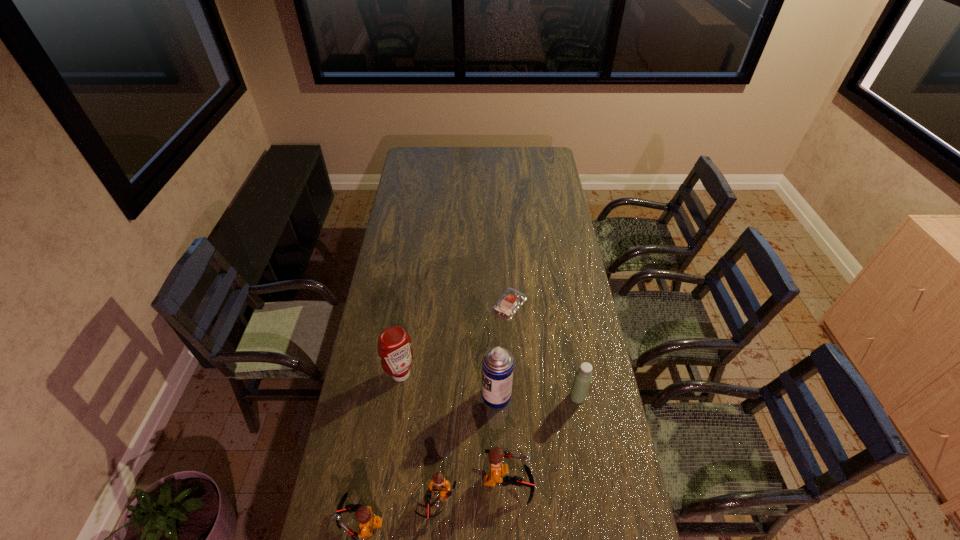
You are a GUI agent. You are given a task and a screenshot of the screen. Output one action in this format:
    pyautogui.click(x=<x>, y=<y>)
    Task: Click on the vacant space located on the front of the second tallest object
    This screenshot has height=540, width=960.
    Given the screenshot: What is the action you would take?
    pyautogui.click(x=388, y=464)

I want to click on vacant area situated on the label side of the tallest object, so click(x=444, y=396).

What are the coordinates of `free space located 0.220m on the label side of the tallest object` in the screenshot? It's located at (420, 396).

Identify the location of vacant space located 0.280m on the label side of the tallest object. Image resolution: width=960 pixels, height=540 pixels. tap(402, 396).

Where is `free space located on the front of the rightmost object`? This screenshot has width=960, height=540. free space located on the front of the rightmost object is located at coordinates (594, 495).

I want to click on object present at the left edge, so click(x=394, y=343).

The width and height of the screenshot is (960, 540). In order to click on object that is positioned at the right edge in this screenshot , I will do `click(583, 377)`.

This screenshot has height=540, width=960. Find the location of `vacant space at the far edge of the desktop`. vacant space at the far edge of the desktop is located at coordinates (489, 163).

I want to click on vacant area at the near edge, so click(x=492, y=516).

The height and width of the screenshot is (540, 960). I want to click on vacant space at the left edge, so click(379, 428).